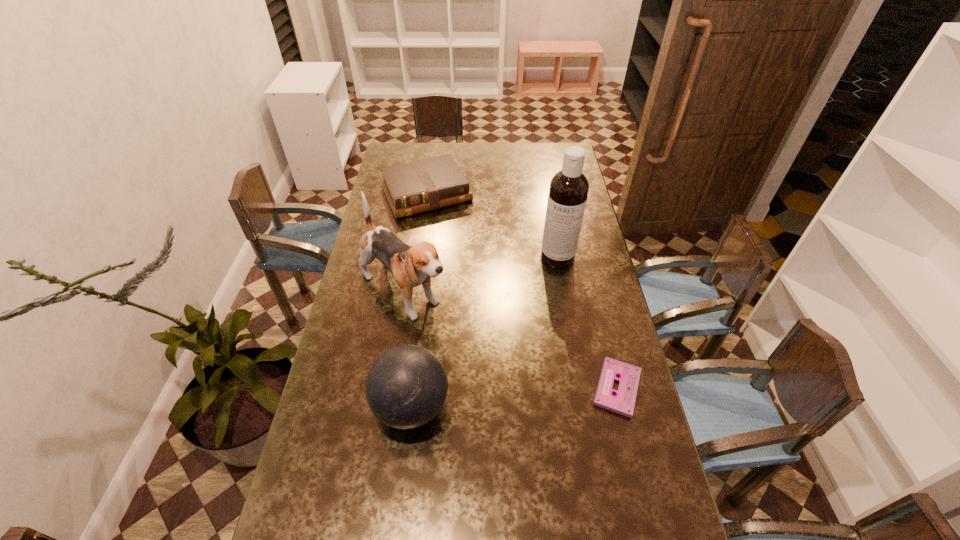
Find the location of `vacant space that satisfies the following two spatial constraints: 1. on the front side of the fourth shortest object; 2. on the grip area of the third tallest object`. vacant space that satisfies the following two spatial constraints: 1. on the front side of the fourth shortest object; 2. on the grip area of the third tallest object is located at coordinates (385, 406).

Identify the location of vacant region that satisfies the following two spatial constraints: 1. on the front side of the bowling ball; 2. on the grip area of the second tallest object. The image size is (960, 540). (385, 406).